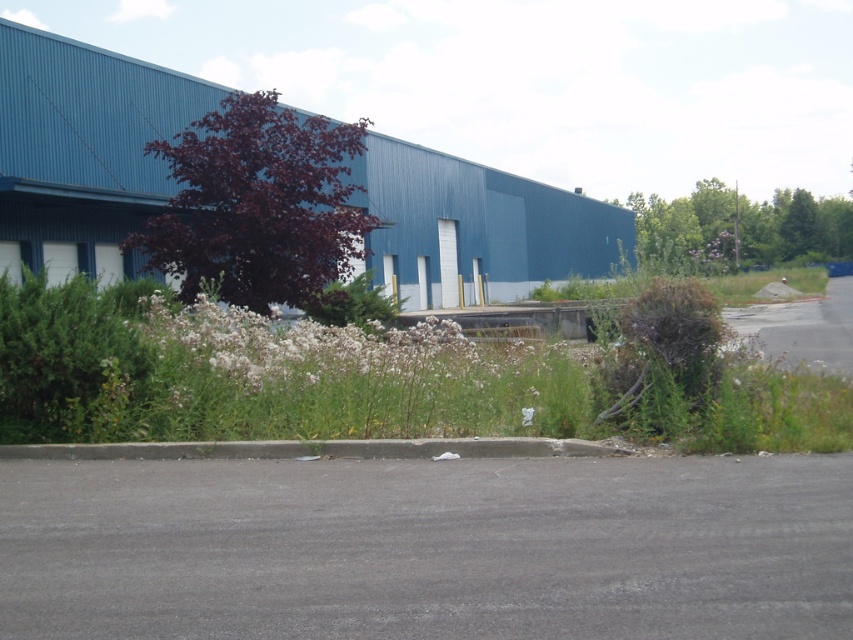
Is white fluffy flowers at center smaller than green grass at center?

Yes.

Does white fluffy flowers at center have a larger size compared to green grass at center?

No, white fluffy flowers at center is not bigger than green grass at center.

Find the location of `white fluffy flowers at center`. white fluffy flowers at center is located at coordinates (325, 348).

Looking at this image, who is positioned more to the left, purple leafy plant at center-left or white fluffy flowers at center?

purple leafy plant at center-left is more to the left.

Does purple leafy plant at center-left have a greater height compared to white fluffy flowers at center?

Yes, purple leafy plant at center-left is taller than white fluffy flowers at center.

Image resolution: width=853 pixels, height=640 pixels. What do you see at coordinates (258, 204) in the screenshot?
I see `purple leafy plant at center-left` at bounding box center [258, 204].

Find the location of `purple leafy plant at center-left`. purple leafy plant at center-left is located at coordinates (258, 204).

Between purple leafy plant at center-left and green grass at center, which one appears on the left side from the viewer's perspective?

Positioned to the left is purple leafy plant at center-left.

The width and height of the screenshot is (853, 640). Identify the location of purple leafy plant at center-left. (258, 204).

Where is `purple leafy plant at center-left`? Image resolution: width=853 pixels, height=640 pixels. purple leafy plant at center-left is located at coordinates (258, 204).